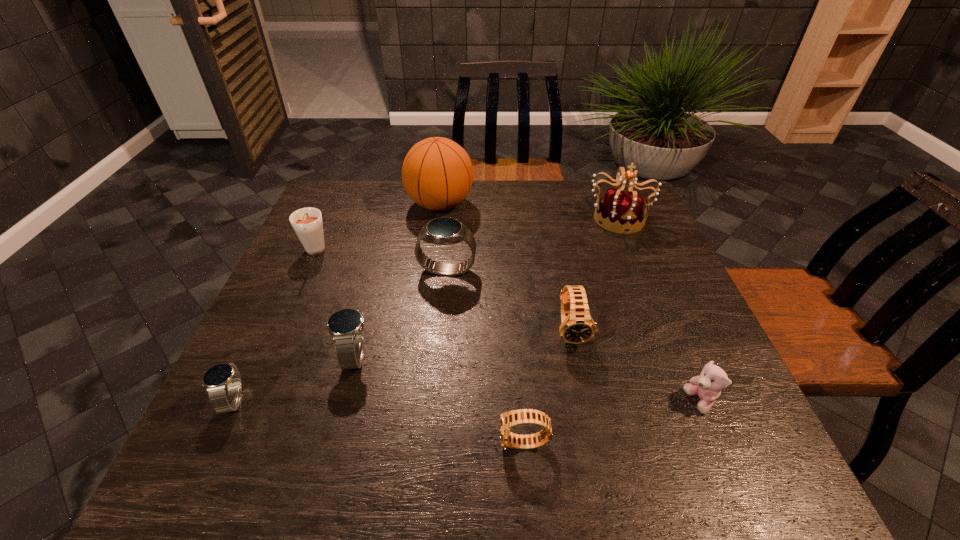
This screenshot has height=540, width=960. What are the coordinates of `orange basketball` in the screenshot? It's located at (437, 173).

Where is `red tiara`? Image resolution: width=960 pixels, height=540 pixels. red tiara is located at coordinates (622, 211).

Image resolution: width=960 pixels, height=540 pixels. Identify the location of the second tallest object. (622, 211).

Find the location of a particular element. This screenshot has width=960, height=540. root beer is located at coordinates (307, 223).

Find the location of a particular element. the farthest watch is located at coordinates (443, 230).

Where is `the third watch from right to left`? the third watch from right to left is located at coordinates [443, 230].

Image resolution: width=960 pixels, height=540 pixels. Find the location of `the rightmost watch`. the rightmost watch is located at coordinates (575, 328).

Identify the location of the right black watch. This screenshot has height=540, width=960. (575, 328).

The width and height of the screenshot is (960, 540). I want to click on the second smallest blue watch, so click(346, 326).

You are a GUI agent. You are given a task and a screenshot of the screen. Output one action in this format:
    pyautogui.click(x=<x>, y=<y>)
    Task: Click on the second blue watch from right to left
    
    Given the screenshot: What is the action you would take?
    pyautogui.click(x=346, y=326)